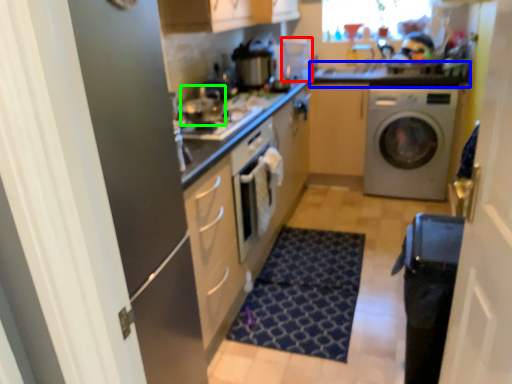
Question: Which is nearer to the coffee machine (highlighted by a red box)? counter top (highlighted by a blue box) or appliance (highlighted by a green box).

Choices:
 (A) counter top
 (B) appliance

Answer: (A)